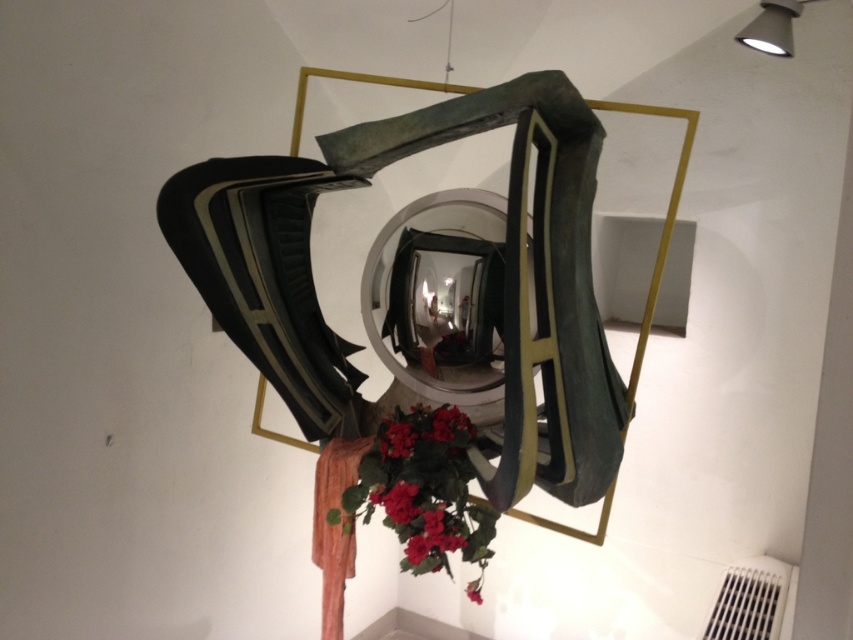
Based on the photo, you are an art curator standing in front of the installation. You notice a point marked at coordinates (396, 438). What object is located at this point?

The point at (396, 438) indicates vibrant matte red flowers at center.

You are an art curator planning to photograph the vibrant matte red flowers at center and the matte red flower at lower center. Which of these two objects is located higher in the image?

The vibrant matte red flowers at center is positioned over the matte red flower at lower center, so it is higher in the image.

You are an art curator planning to photograph the installation. You notice the vibrant matte red flowers at center and the matte red flower at lower center. Which of these two objects would appear larger in the photo?

The vibrant matte red flowers at center would appear larger in the photo because their width is larger than the matte red flower at lower center.